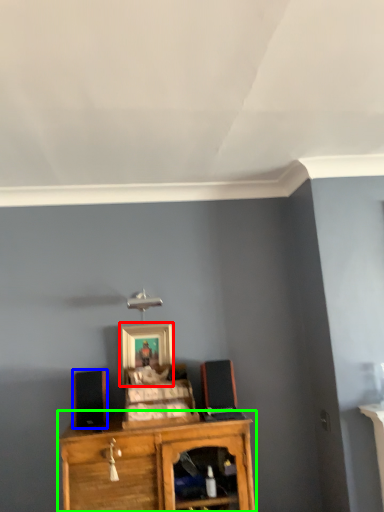
Question: Considering the real-world distances, which object is farthest from picture frame (highlighted by a red box)? speaker (highlighted by a blue box) or shelf (highlighted by a green box)?

Choices:
 (A) speaker
 (B) shelf

Answer: (B)